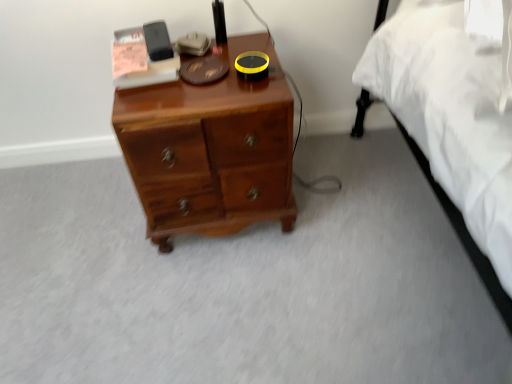
The height and width of the screenshot is (384, 512). I want to click on vacant space in front of shiny wood chest of drawers at center, so click(x=216, y=303).